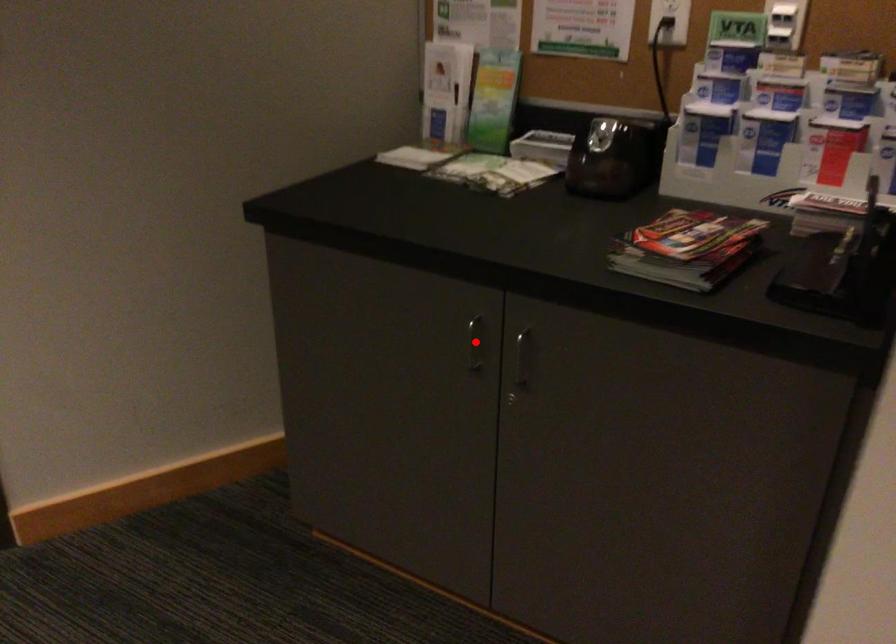
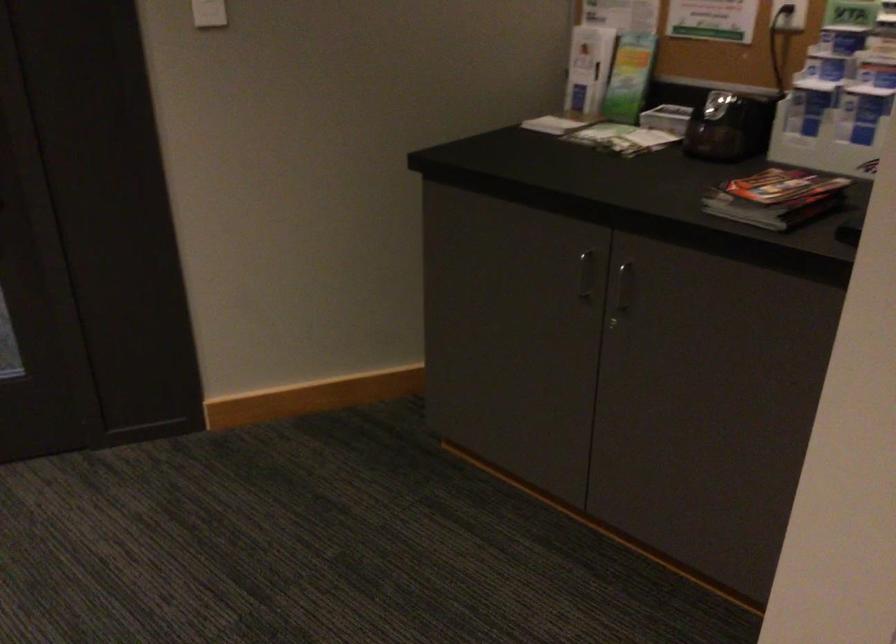
Question: A red point is marked in image1. In image2, is the corresponding 3D point closer to the camera or farther? Reply with the corresponding letter.

Choices:
 (A) The corresponding 3D point is closer.
 (B) The corresponding 3D point is farther.

Answer: (B)